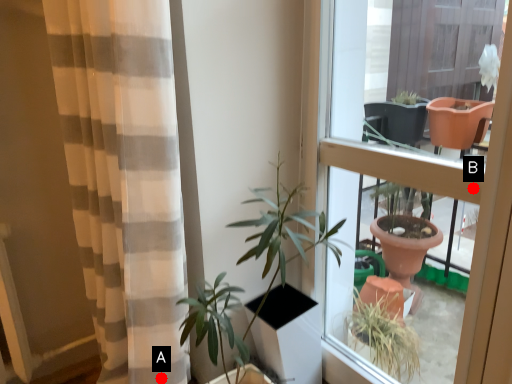
Question: Two points are circled on the image, labeled by A and B beside each circle. Among these points, which one is farthest from the camera?

Choices:
 (A) A is further
 (B) B is further

Answer: (A)